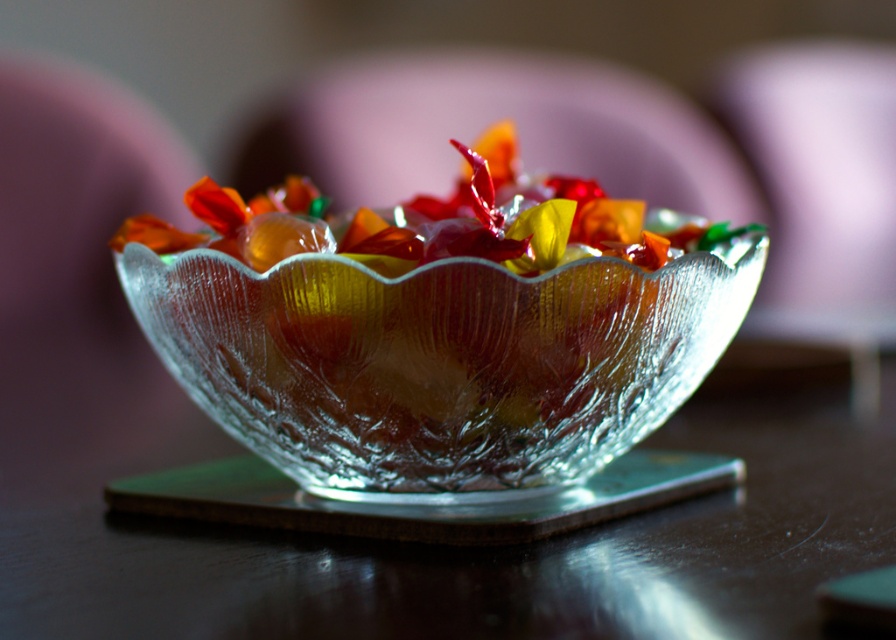
Is transparent textured glass bowl at center to the left of transparent glass plate at center from the viewer's perspective?

Incorrect, transparent textured glass bowl at center is not on the left side of transparent glass plate at center.

Is transparent textured glass bowl at center further to camera compared to transparent glass plate at center?

That is False.

Between point (425, 416) and point (208, 488), which one is positioned behind?

The point (208, 488) is behind.

The width and height of the screenshot is (896, 640). What are the coordinates of `transparent textured glass bowl at center` in the screenshot? It's located at (438, 362).

Looking at this image, between transparent glass bowl at center and translucent glass bowl at center, which one is positioned lower?

Positioned lower is transparent glass bowl at center.

Measure the distance between transparent glass bowl at center and camera.

transparent glass bowl at center is 30.59 centimeters away from camera.

Does point (323, 586) come behind point (645, 240)?

No, (323, 586) is closer to viewer.

The image size is (896, 640). Find the location of `transparent glass bowl at center`. transparent glass bowl at center is located at coordinates (468, 548).

Between point (260, 339) and point (599, 221), which one is positioned in front?

Point (260, 339)

The image size is (896, 640). Find the location of `transparent textured glass bowl at center`. transparent textured glass bowl at center is located at coordinates (438, 362).

Image resolution: width=896 pixels, height=640 pixels. I want to click on transparent textured glass bowl at center, so click(x=438, y=362).